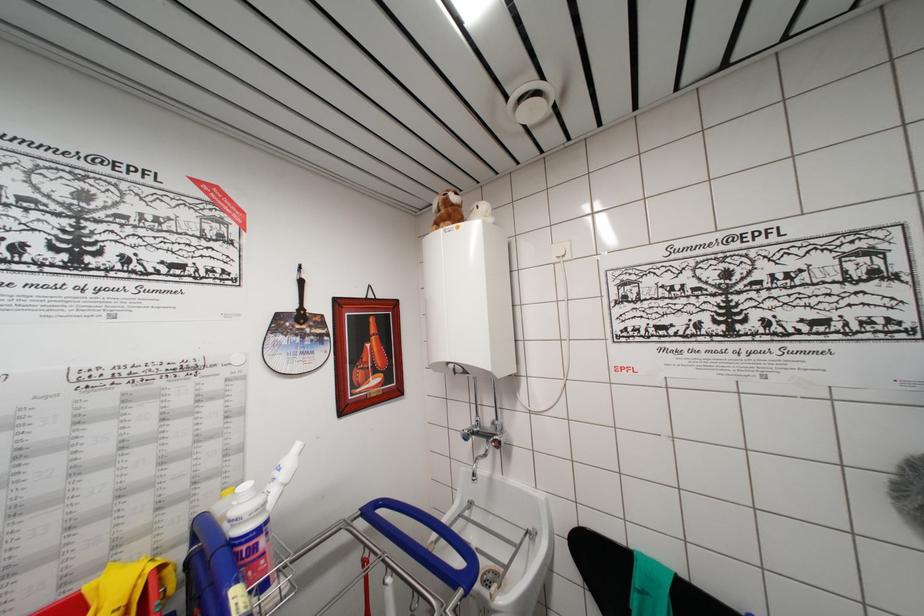
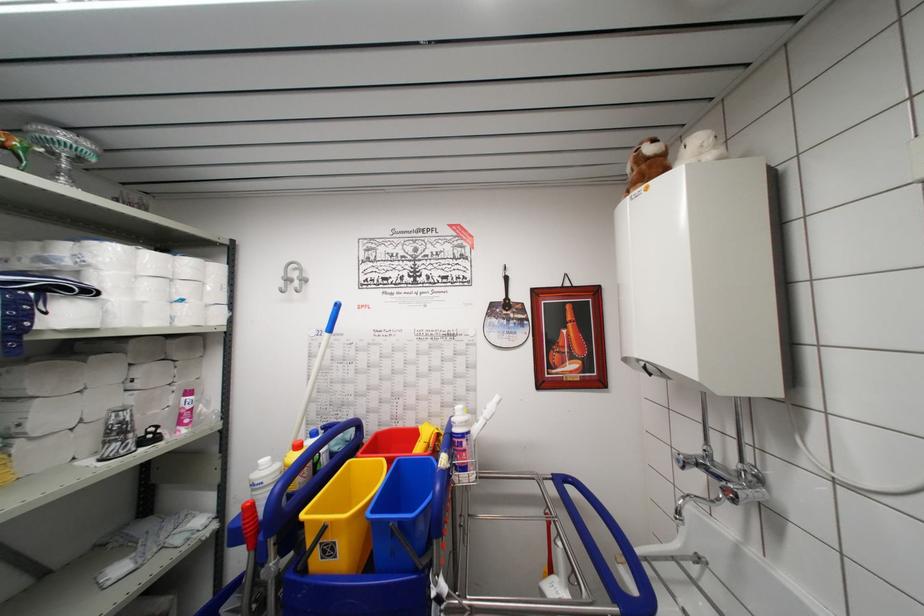
Question: I am providing you with two images of the same scene from different viewpoints. Which of the following objects are not visible in image2?

Choices:
 (A) white cleaning bottle
 (B) blue bucket
 (C) yellow bucket
 (D) none of these

Answer: (D)